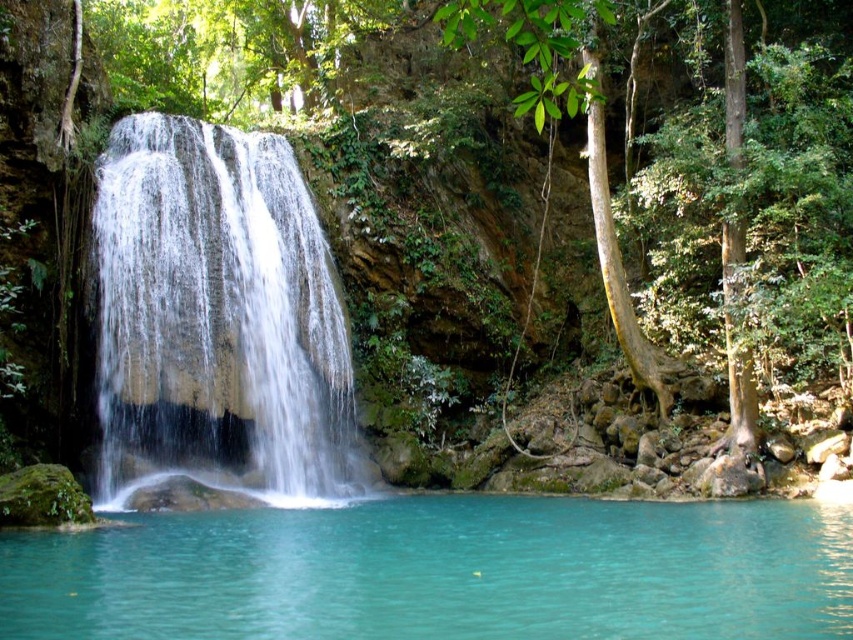
You are standing at the base of the waterfall and want to reach a hidden treasure located at point (128, 282). There is an obstacle at point (650, 627) blocking your path. Can you safely navigate around the obstacle to reach the treasure without getting too close to the waterfall?

Since point (650, 627) is in front of point (128, 282), you can safely navigate around the obstacle by moving around it to reach the treasure without getting too close to the waterfall.

You are a photographer standing at the base of the waterfall. You want to capture a photo that includes both the turquoise liquid at center and the white smooth waterfall at center. Based on their positions, which object should you position closer to the right side of your camera frame?

The turquoise liquid at center should be positioned closer to the right side of your camera frame since it is located to the right of the white smooth waterfall at center.